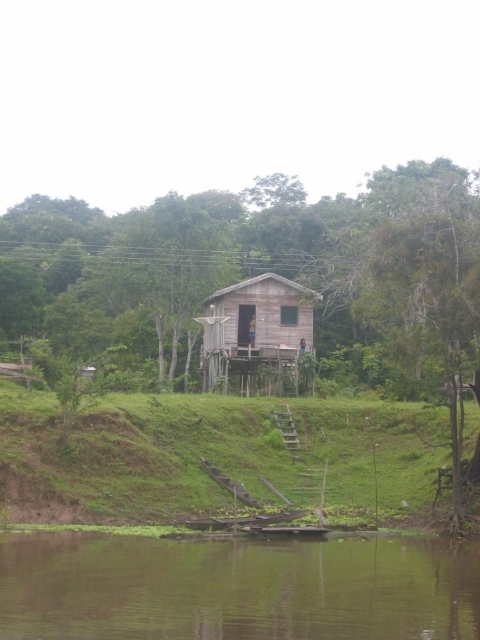
You are standing at the point labeled point (84,612) and want to walk to the small wooden house elevated on stilts. Given that the distance between you and the house is 17.40 meters, is this distance sufficient to safely cross the area without any obstacles?

The distance between the point labeled point (84,612) and the viewer is 17.40 meters. Since the path is clear and there are no obstacles mentioned in the scene description, you can safely walk to the small wooden house elevated on stilts.

From the picture: You are planning to build a small garden between the green smooth water at lower center and the green grassy hillside at lower center. Which area has a narrower width to consider for the garden layout?

The green smooth water at lower center is thinner than the green grassy hillside at lower center, so the green smooth water at lower center has a narrower width for the garden layout.